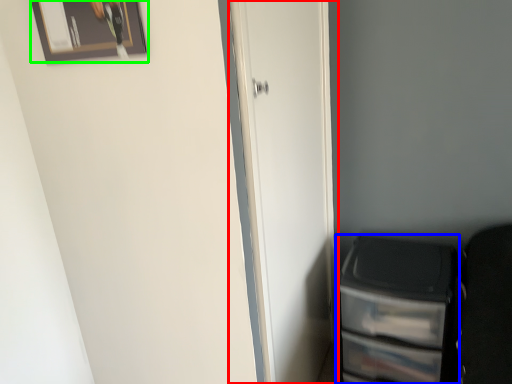
Question: Based on their relative distances, which object is farther from door (highlighted by a red box)? Choose from file cabinet (highlighted by a blue box) and picture frame (highlighted by a green box).

Choices:
 (A) file cabinet
 (B) picture frame

Answer: (B)